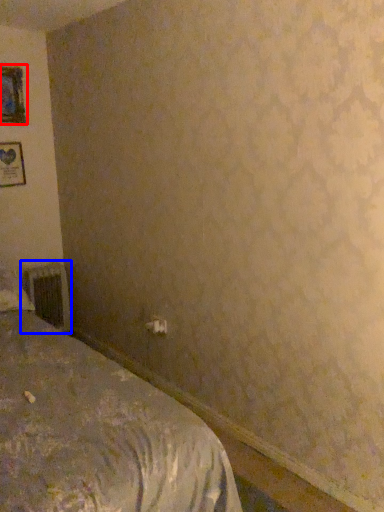
Question: Among these objects, which one is nearest to the camera, picture frame (highlighted by a red box) or radiator (highlighted by a blue box)?

Choices:
 (A) picture frame
 (B) radiator

Answer: (A)